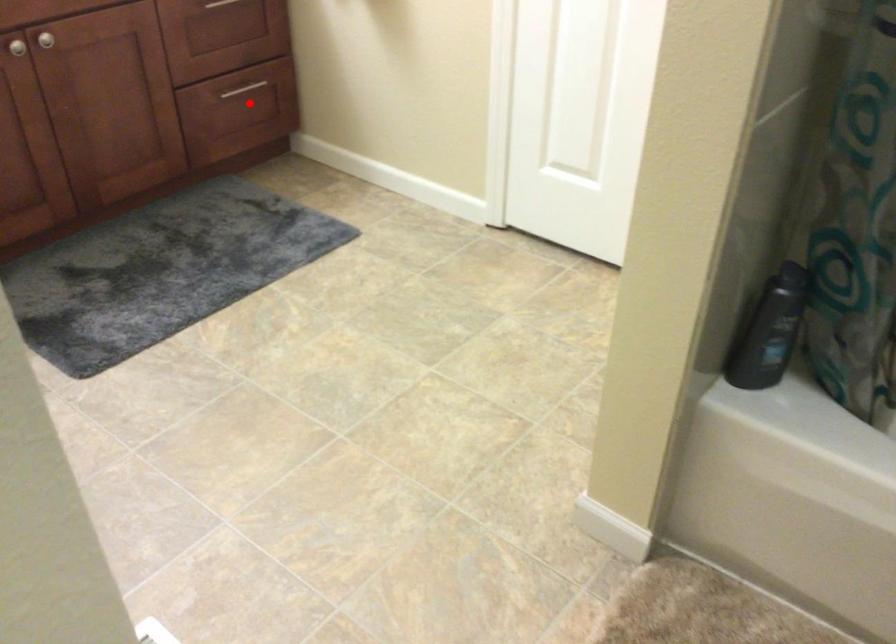
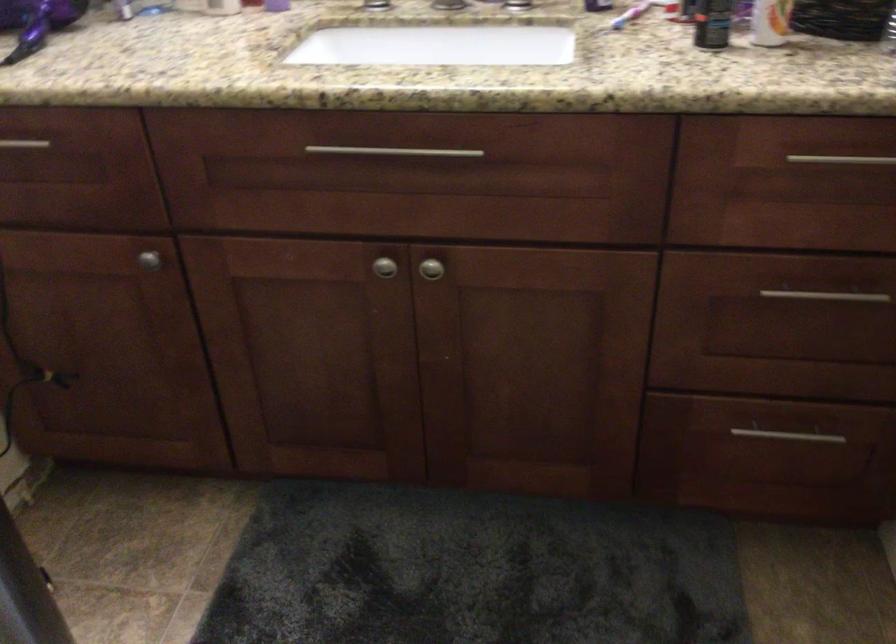
The point at the highlighted location is marked in the first image. Where is the corresponding point in the second image?

(778, 446)